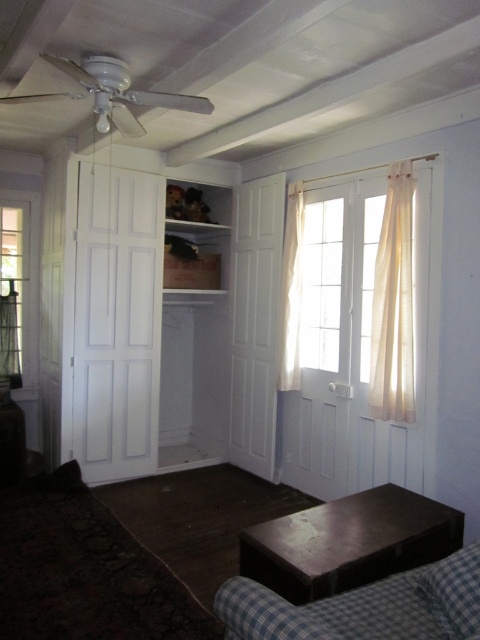
Question: Which of the following is the farthest from the observer?

Choices:
 (A) (389, 221)
 (B) (249, 625)
 (C) (442, 556)

Answer: (A)

Question: Where is ivory sheer curtain at right located in relation to sheer fabric curtain at right in the image?

Choices:
 (A) right
 (B) left

Answer: (A)

Question: Which is nearer to the checkered fabric couch at lower right?

Choices:
 (A) shiny dark wood coffee table at lower right
 (B) sheer fabric curtain at right
 (C) ivory sheer curtain at right

Answer: (A)

Question: Does shiny dark wood coffee table at lower right have a larger size compared to sheer fabric curtain at right?

Choices:
 (A) no
 (B) yes

Answer: (B)

Question: Based on their relative distances, which object is farther from the shiny dark wood coffee table at lower right?

Choices:
 (A) checkered fabric couch at lower right
 (B) sheer fabric curtain at right

Answer: (B)

Question: Is ivory sheer curtain at right wider than sheer fabric curtain at right?

Choices:
 (A) yes
 (B) no

Answer: (A)